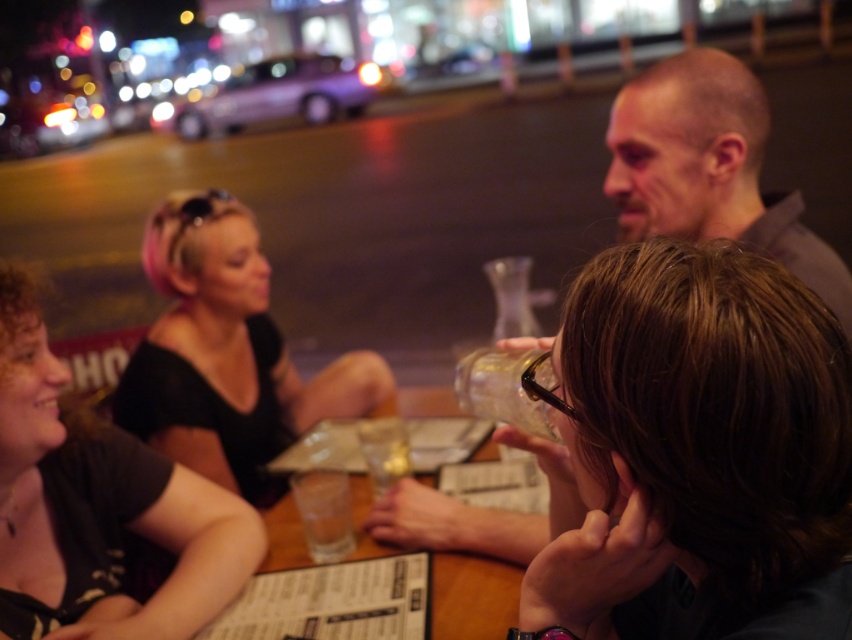
Is transparent glass bottle at center to the right of transparent glass at center from the viewer's perspective?

Correct, you'll find transparent glass bottle at center to the right of transparent glass at center.

Is point (536, 385) closer to viewer compared to point (334, 522)?

That is True.

The width and height of the screenshot is (852, 640). What are the coordinates of `transparent glass bottle at center` in the screenshot? It's located at (510, 388).

Is point (371, 364) in front of point (517, 376)?

No, (371, 364) is behind (517, 376).

Is pink hair at center wider than transparent glass bottle at center?

Yes, pink hair at center is wider than transparent glass bottle at center.

Which is in front, point (286, 416) or point (511, 364)?

Point (511, 364) is in front.

Locate an element on the screen. pink hair at center is located at coordinates (225, 352).

Who is taller, pink hair at center or transparent glass at center?

With more height is pink hair at center.

Is pink hair at center to the left of transparent glass at center from the viewer's perspective?

Indeed, pink hair at center is positioned on the left side of transparent glass at center.

Describe the element at coordinates (225, 352) in the screenshot. This screenshot has width=852, height=640. I see `pink hair at center` at that location.

Where is `pink hair at center`? This screenshot has height=640, width=852. pink hair at center is located at coordinates (225, 352).